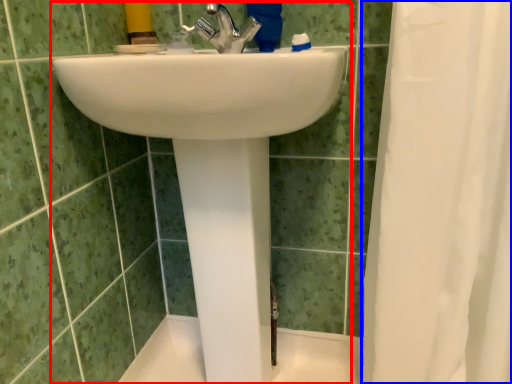
Question: Among these objects, which one is farthest to the camera, sink (highlighted by a red box) or shower curtain (highlighted by a blue box)?

Choices:
 (A) sink
 (B) shower curtain

Answer: (A)